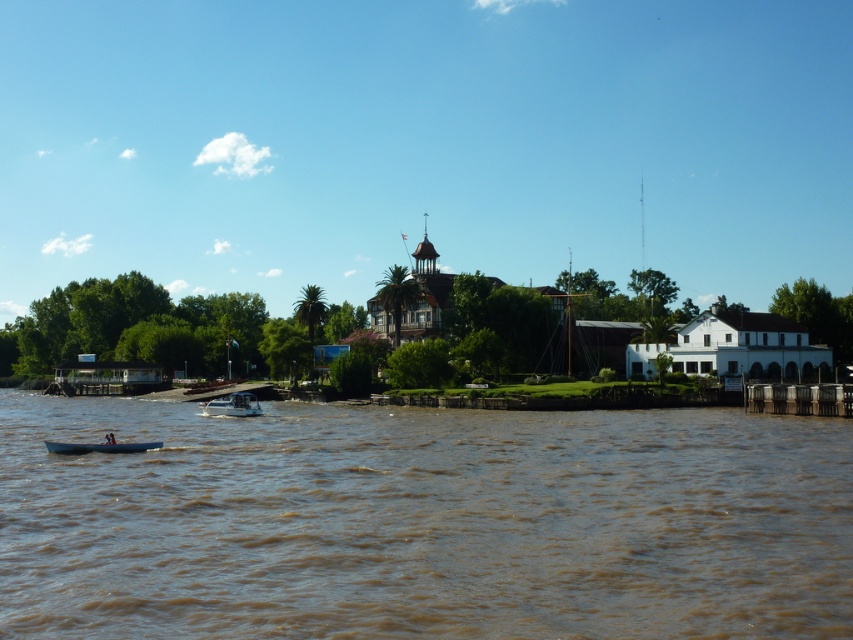
Does point (524, 435) come farther from viewer compared to point (134, 444)?

Yes, it is.

Does brown muddy water at lower center lie in front of blue plastic boat at center?

That is True.

Locate an element on the screen. brown muddy water at lower center is located at coordinates click(x=422, y=522).

Is white glossy boat at center further to camera compared to blue plastic boat at center?

Yes, white glossy boat at center is behind blue plastic boat at center.

Who is positioned more to the right, white glossy boat at center or blue plastic boat at center?

blue plastic boat at center

At what (x,y) coordinates should I click in order to perform the action: click on white glossy boat at center. Please return your answer as a coordinate pair (x, y). This screenshot has width=853, height=640. Looking at the image, I should click on (233, 404).

Does point (766, 625) lie in front of point (253, 404)?

Yes, it is.

Can you confirm if brown muddy water at lower center is wider than white glossy boat at center?

Yes.

Is point (537, 500) positioned behind point (235, 413)?

No, it is not.

Locate an element on the screen. The width and height of the screenshot is (853, 640). brown muddy water at lower center is located at coordinates (422, 522).